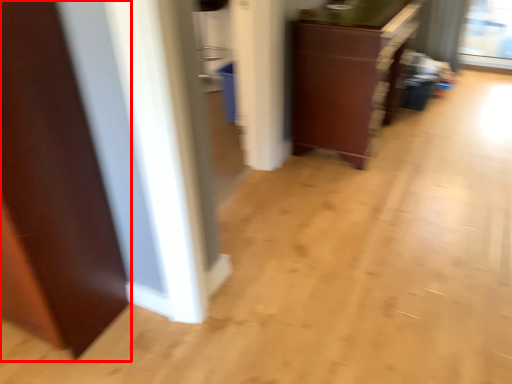
Question: From the image's perspective, what is the correct spatial positioning of door (annotated by the red box) in reference to cabinetry?

Choices:
 (A) above
 (B) below

Answer: (B)